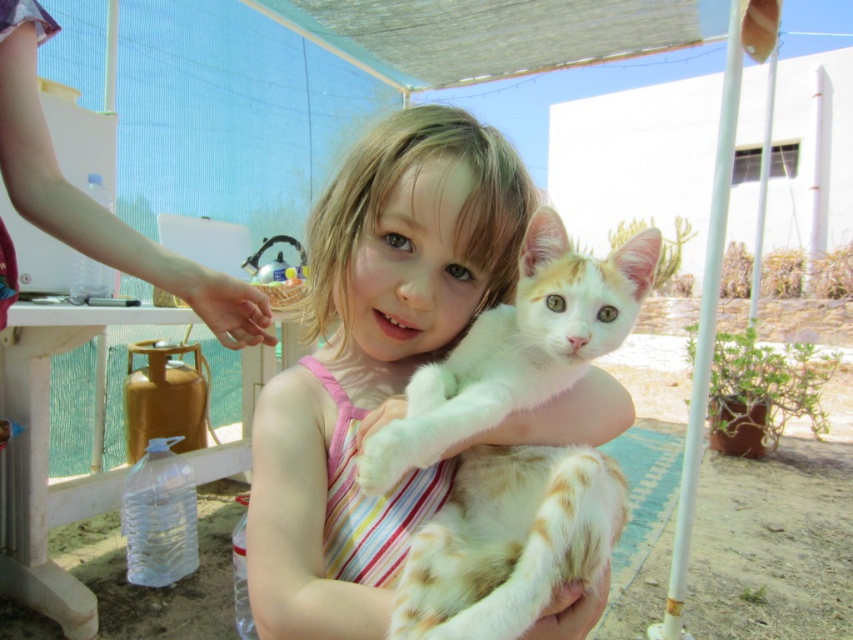
You are a photographer trying to capture the girl and her cat in the scene. Since the white soft fabric dress at center and the white fluffy cat at center are both white, how can you distinguish them in your photo?

The white soft fabric dress at center is taller than the white fluffy cat at center, so you can distinguish them by their height difference.

From the picture: You are a fashion designer observing the image. You need to determine which item is larger between the white soft fabric dress at center and the white fluffy cat at center. Which one is bigger?

The white soft fabric dress at center is bigger than the white fluffy cat at center according to the description.

The young girl is wearing a white soft fabric dress at center. She wants to place her cat on the ground without letting the cat touch her dress. The cat is currently at the same height as the dress. How much distance in centimeters should she keep between the cat and the dress to ensure safety?

The young girl should keep at least 57.73 centimeters between the cat and the white soft fabric dress at center to ensure the cat doesn not touch the dress.